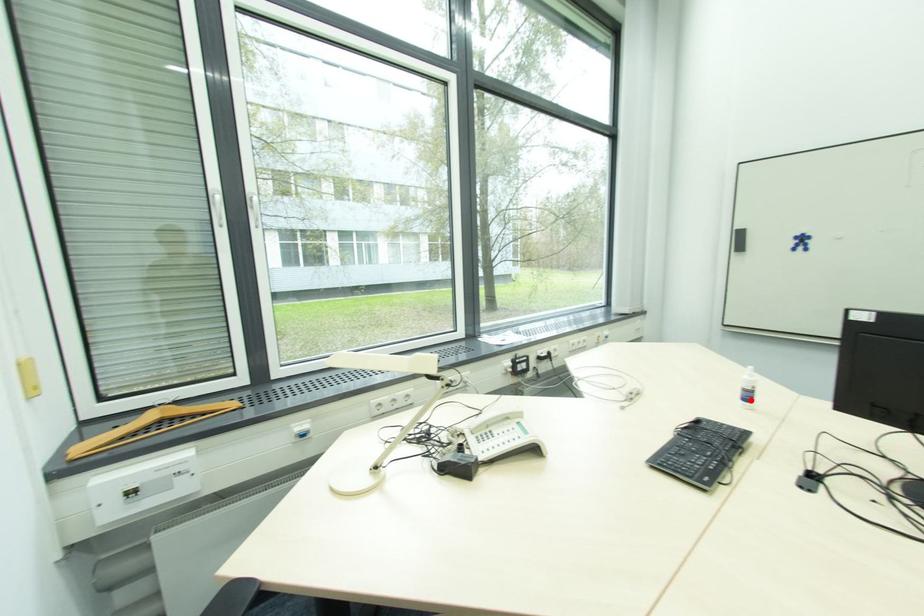
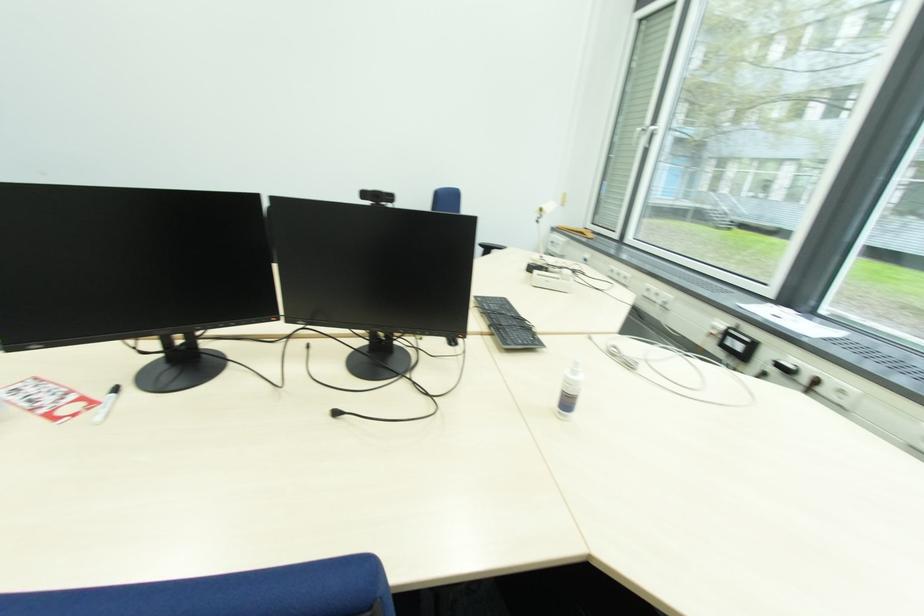
Locate, in the second image, the point that corresponds to the highlighted location in the first image.

(570, 405)